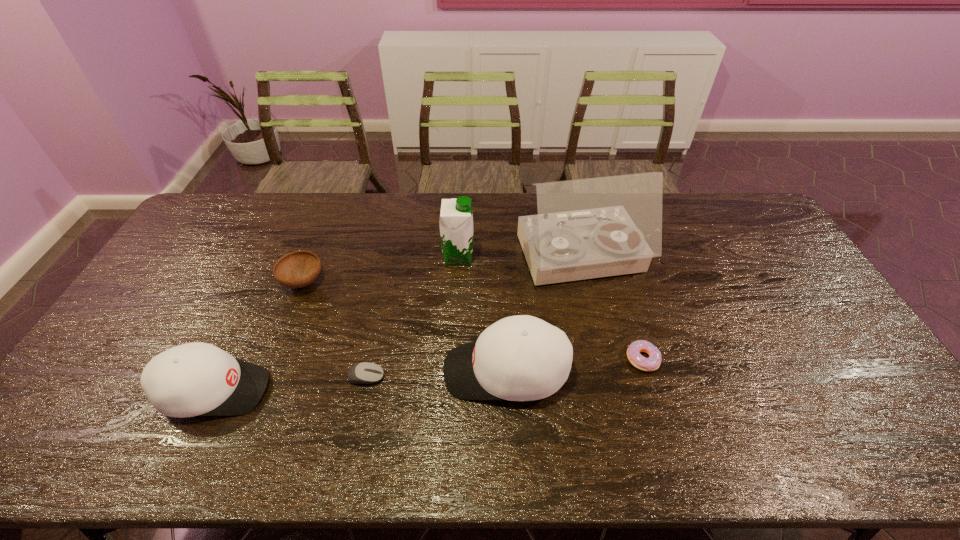
The image size is (960, 540). In order to click on free space for a new baseball cap on the right in this screenshot , I will do `click(778, 353)`.